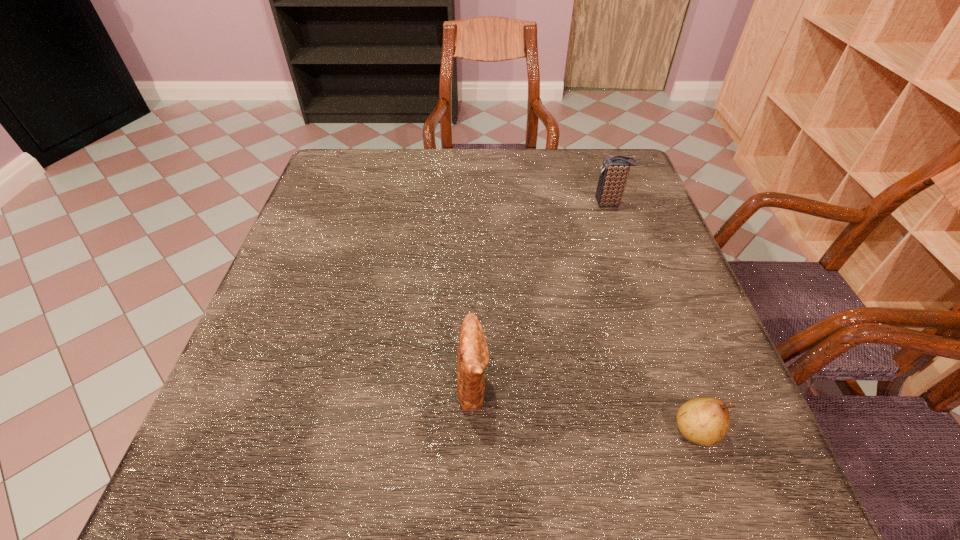
Image resolution: width=960 pixels, height=540 pixels. What are the coordinates of `object that is the closest to the left clutch bag` in the screenshot? It's located at (704, 421).

Find the location of a particular element. The image size is (960, 540). free space in the image that satisfies the following two spatial constraints: 1. on the open side of the left clutch bag; 2. on the back side of the pear is located at coordinates (473, 430).

The width and height of the screenshot is (960, 540). Identify the location of vacant area in the image that satisfies the following two spatial constraints: 1. on the open side of the nearer clutch bag; 2. on the right side of the shortest object. (473, 430).

Identify the location of vacant space that satisfies the following two spatial constraints: 1. on the open side of the shortest object; 2. on the left side of the nearer clutch bag. (473, 430).

Where is `vacant space that satisfies the following two spatial constraints: 1. with the zip open on the shortest object; 2. on the right side of the farther clutch bag`? The image size is (960, 540). vacant space that satisfies the following two spatial constraints: 1. with the zip open on the shortest object; 2. on the right side of the farther clutch bag is located at coordinates (685, 430).

I want to click on blank space that satisfies the following two spatial constraints: 1. with the zip open on the right clutch bag; 2. on the left side of the shortest object, so click(x=685, y=430).

Identify the location of free spot that satisfies the following two spatial constraints: 1. with the zip open on the right clutch bag; 2. on the back side of the pear. point(685,430).

This screenshot has height=540, width=960. Find the location of `vacant area in the image that satisfies the following two spatial constraints: 1. with the zip open on the farther clutch bag; 2. on the back side of the shortest object`. vacant area in the image that satisfies the following two spatial constraints: 1. with the zip open on the farther clutch bag; 2. on the back side of the shortest object is located at coordinates (685, 430).

This screenshot has width=960, height=540. Find the location of `free location that satisfies the following two spatial constraints: 1. on the open side of the shortest object; 2. on the right side of the nearer clutch bag`. free location that satisfies the following two spatial constraints: 1. on the open side of the shortest object; 2. on the right side of the nearer clutch bag is located at coordinates (473, 430).